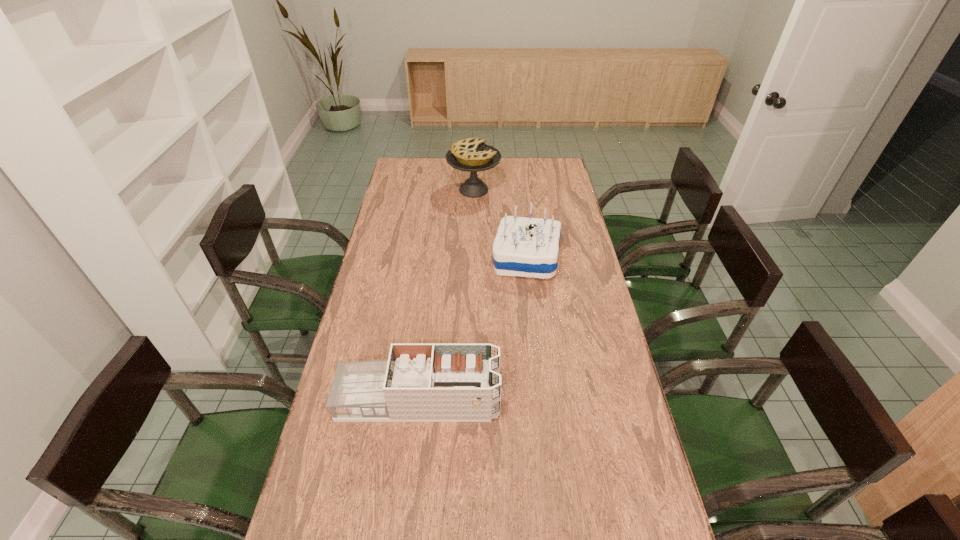
Locate an element on the screen. This screenshot has height=540, width=960. free space in the image that satisfies the following two spatial constraints: 1. on the front side of the second farthest object; 2. at the entrance of the nearest object is located at coordinates (543, 400).

Image resolution: width=960 pixels, height=540 pixels. I want to click on free spot that satisfies the following two spatial constraints: 1. on the cut side of the pie; 2. on the right side of the second farthest object, so tap(472, 258).